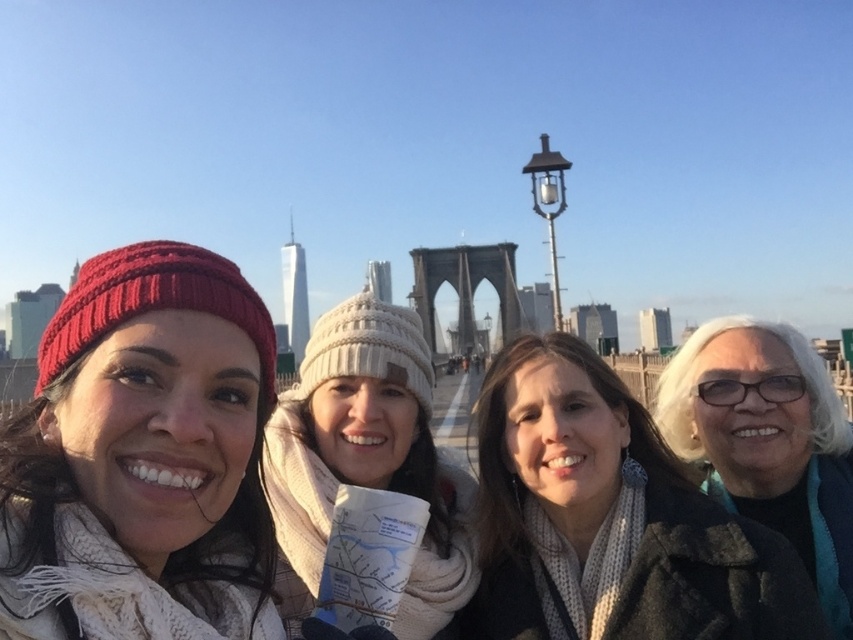
Question: Is matte white scarf at center positioned behind white glossy coat at lower right?

Choices:
 (A) no
 (B) yes

Answer: (A)

Question: Which object appears farthest from the camera in this image?

Choices:
 (A) white knitted hat at center
 (B) matte white scarf at center
 (C) white glossy coat at lower right

Answer: (A)

Question: Which object is farther from the camera taking this photo?

Choices:
 (A) white glossy coat at lower right
 (B) matte white scarf at center
 (C) knitted red beanie at left

Answer: (A)

Question: Which object is closer to the camera taking this photo?

Choices:
 (A) white knitted hat at center
 (B) white glossy coat at lower right
 (C) knitted red beanie at left
 (D) matte white scarf at center

Answer: (C)

Question: Is matte white scarf at center wider than white knitted hat at center?

Choices:
 (A) no
 (B) yes

Answer: (A)

Question: Does knitted red beanie at left have a greater width compared to white knitted hat at center?

Choices:
 (A) no
 (B) yes

Answer: (A)